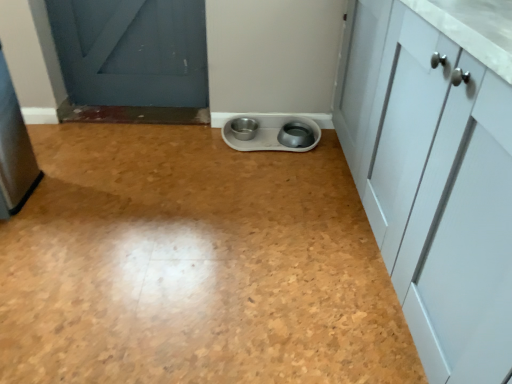
Identify the location of vacant area that lies between metallic gray bowls at center, arranged as the first appliance when viewed from the back, and brushed metal refrigerator at left, the 2th appliance when ordered from back to front. (147, 165).